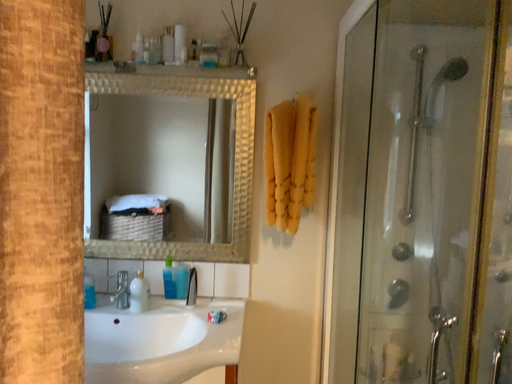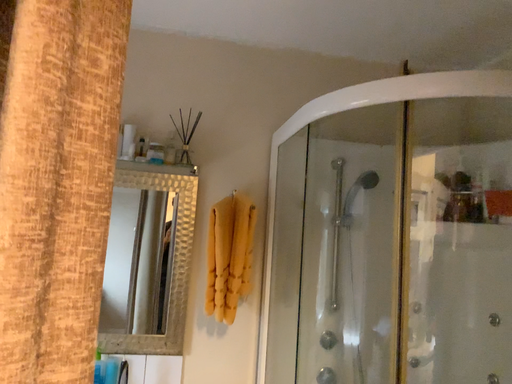
Question: How did the camera likely rotate when shooting the video?

Choices:
 (A) rotated downward
 (B) rotated upward

Answer: (B)